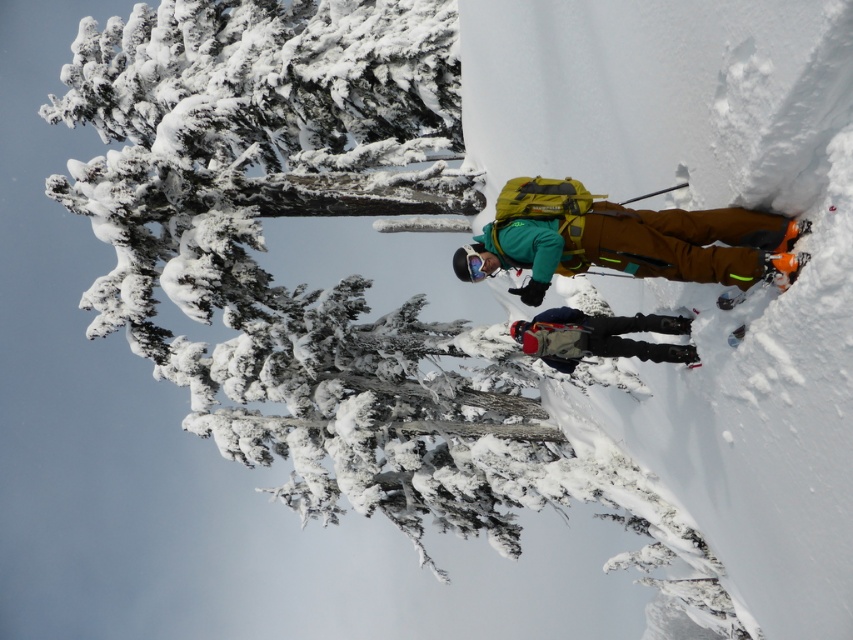
Question: Which object is positioned farthest from the matte black backpack at center?

Choices:
 (A) snow-covered evergreen tree at upper left
 (B) matte green jacket at center

Answer: (A)

Question: Can you confirm if snow-covered evergreen tree at upper left is smaller than matte black backpack at center?

Choices:
 (A) yes
 (B) no

Answer: (B)

Question: Which point is closer to the camera?

Choices:
 (A) (426, 188)
 (B) (689, 259)
 (C) (563, 355)

Answer: (B)

Question: Which object appears closest to the camera in this image?

Choices:
 (A) matte green jacket at center
 (B) snow-covered evergreen tree at upper left

Answer: (A)

Question: Does snow-covered evergreen tree at upper left appear on the right side of matte black backpack at center?

Choices:
 (A) yes
 (B) no

Answer: (B)

Question: Does snow-covered evergreen tree at upper left appear on the right side of matte black backpack at center?

Choices:
 (A) yes
 (B) no

Answer: (B)